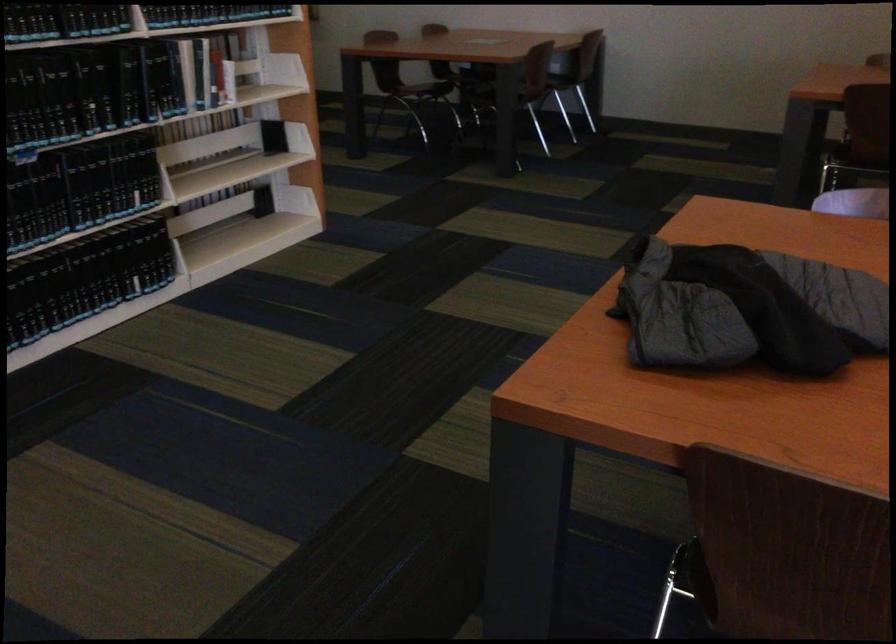
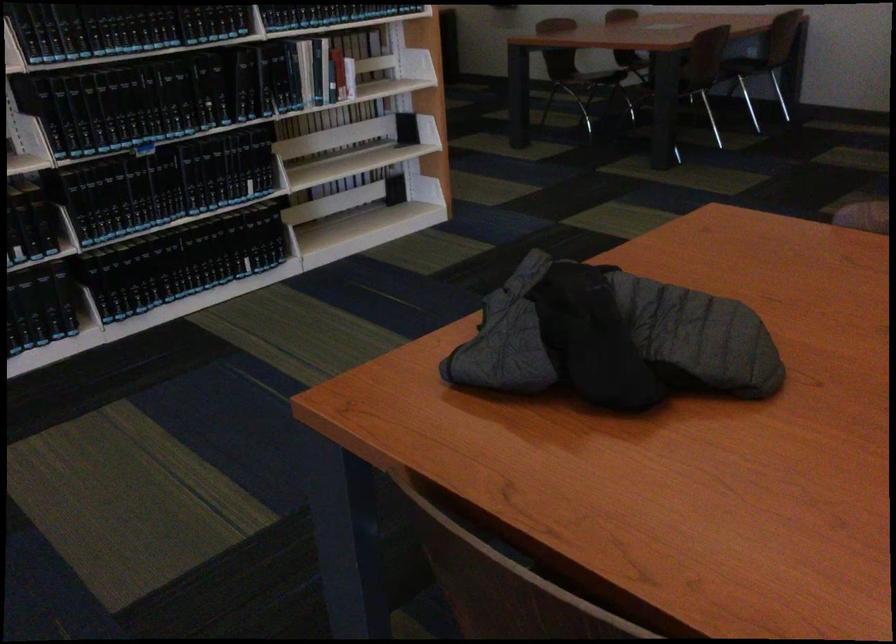
Question: The camera is either moving clockwise (left) or counter-clockwise (right) around the object. The first image is from the beginning of the video and the second image is from the end. Is the camera moving left or right when shooting the video?

Choices:
 (A) Left
 (B) Right

Answer: (B)